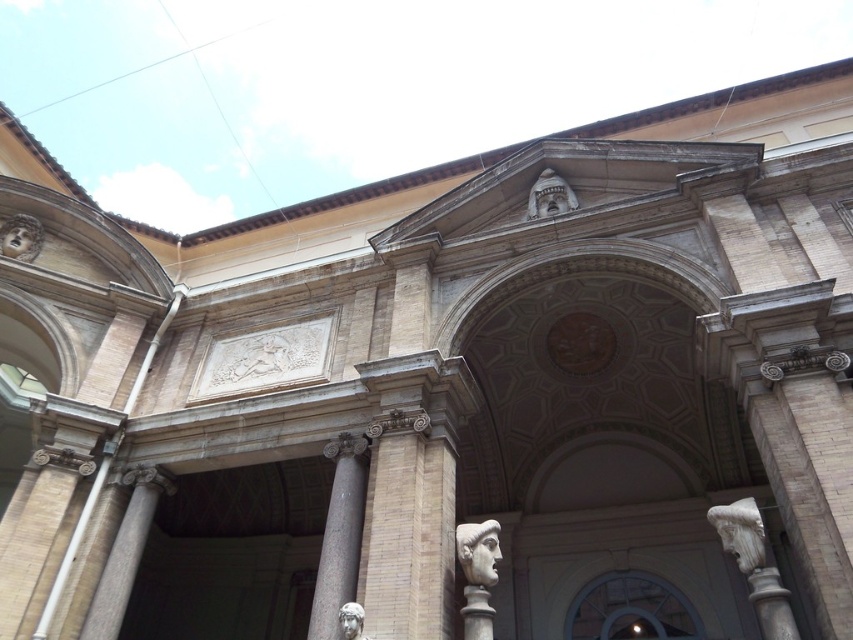
Does gray marble column at center have a greater height compared to white marble statue at lower center?

Indeed, gray marble column at center has a greater height compared to white marble statue at lower center.

In the scene shown: Is gray marble column at center above white marble statue at lower center?

Yes, gray marble column at center is above white marble statue at lower center.

Find the location of a particular element. The width and height of the screenshot is (853, 640). gray marble column at center is located at coordinates 339,536.

Locate an element on the screen. gray marble column at center is located at coordinates (339, 536).

Is the position of white marble head at right less distant than that of white marble head at center?

Yes.

Can you confirm if white marble head at right is shorter than white marble head at center?

Incorrect, white marble head at right's height does not fall short of white marble head at center's.

Where is `white marble head at right`? This screenshot has height=640, width=853. white marble head at right is located at coordinates (740, 532).

Between point (329, 552) and point (612, 625), which one is positioned behind?

The point (612, 625) is more distant.

Describe the element at coordinates (339, 536) in the screenshot. I see `gray marble column at center` at that location.

What do you see at coordinates (339, 536) in the screenshot? The width and height of the screenshot is (853, 640). I see `gray marble column at center` at bounding box center [339, 536].

Locate an element on the screen. gray marble column at center is located at coordinates 339,536.